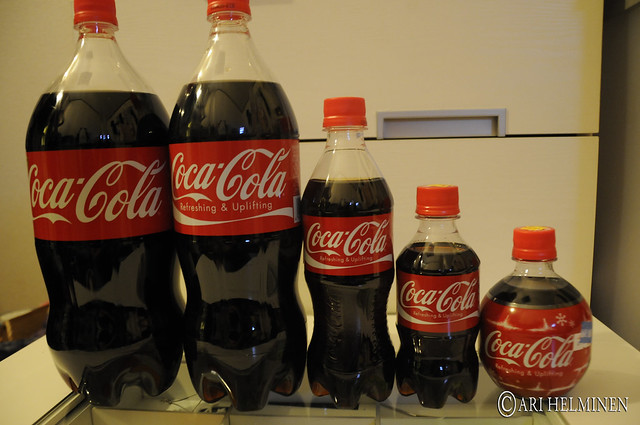
The image size is (640, 425). Find the location of `bottle`. bottle is located at coordinates (125, 251), (208, 276), (368, 313), (445, 337), (541, 357).